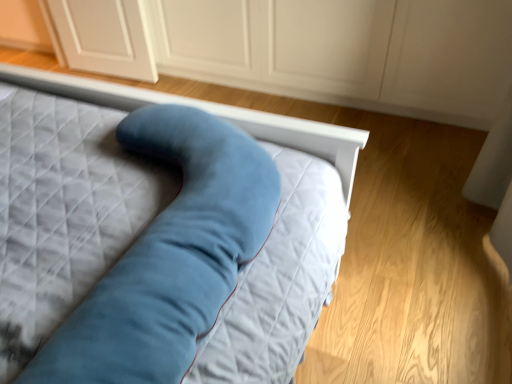
Describe the element at coordinates (347, 52) in the screenshot. I see `matte white dresser at center` at that location.

This screenshot has height=384, width=512. In order to click on matte white dresser at center in this screenshot , I will do tap(347, 52).

Locate an element on the screen. Image resolution: width=512 pixels, height=384 pixels. velvet blue pillow at center is located at coordinates (215, 114).

Measure the distance between point (313, 146) and camera.

Point (313, 146) is 1.28 meters from camera.

Describe the element at coordinates (215, 114) in the screenshot. I see `velvet blue pillow at center` at that location.

Identify the location of matte white dresser at center. The image size is (512, 384). (347, 52).

Between velvet blue pillow at center and matte white dresser at center, which one appears on the left side from the viewer's perspective?

velvet blue pillow at center is more to the left.

Is velvet blue pillow at center closer to the viewer compared to matte white dresser at center?

Yes, velvet blue pillow at center is closer to the viewer.

Does point (261, 135) lie in front of point (469, 12)?

Yes, it is in front of point (469, 12).

From the image's perspective, between velvet blue pillow at center and matte white dresser at center, who is located below?

velvet blue pillow at center.

From a real-world perspective, is velvet blue pillow at center over matte white dresser at center?

Yes.

Can you confirm if velvet blue pillow at center is wider than matte white dresser at center?

Yes.

In the scene shown: Considering the relative sizes of velvet blue pillow at center and matte white dresser at center in the image provided, is velvet blue pillow at center shorter than matte white dresser at center?

Yes, velvet blue pillow at center is shorter than matte white dresser at center.

Who is bigger, velvet blue pillow at center or matte white dresser at center?

With larger size is matte white dresser at center.

Could matte white dresser at center be considered to be inside velvet blue pillow at center?

Actually, matte white dresser at center is outside velvet blue pillow at center.

Is velvet blue pillow at center beside matte white dresser at center?

No, velvet blue pillow at center is not next to matte white dresser at center.

Looking at this image, is velvet blue pillow at center oriented towards matte white dresser at center?

Yes, velvet blue pillow at center faces towards matte white dresser at center.

How much distance is there between velvet blue pillow at center and matte white dresser at center?

velvet blue pillow at center and matte white dresser at center are 1.14 meters apart from each other.

This screenshot has width=512, height=384. I want to click on bed that appears on the left of matte white dresser at center, so click(x=215, y=114).

Would you say matte white dresser at center is to the left or to the right of velvet blue pillow at center in the picture?

From the image, it's evident that matte white dresser at center is to the right of velvet blue pillow at center.

Between matte white dresser at center and velvet blue pillow at center, which one is positioned behind?

matte white dresser at center is behind.

Considering the points (351, 70) and (270, 133), which point is in front, point (351, 70) or point (270, 133)?

Positioned in front is point (270, 133).

From the image's perspective, does matte white dresser at center appear higher than velvet blue pillow at center?

Correct, matte white dresser at center appears higher than velvet blue pillow at center in the image.

From a real-world perspective, is matte white dresser at center on top of velvet blue pillow at center?

Actually, matte white dresser at center is physically below velvet blue pillow at center in the real world.

Considering the sizes of objects matte white dresser at center and velvet blue pillow at center in the image provided, who is wider, matte white dresser at center or velvet blue pillow at center?

velvet blue pillow at center.

Can you confirm if matte white dresser at center is taller than velvet blue pillow at center?

Indeed, matte white dresser at center has a greater height compared to velvet blue pillow at center.

Consider the image. Which of these two, matte white dresser at center or velvet blue pillow at center, is smaller?

velvet blue pillow at center is smaller.

Choose the correct answer: Is matte white dresser at center inside velvet blue pillow at center or outside it?

matte white dresser at center is not enclosed by velvet blue pillow at center.

Would you say matte white dresser at center is a long distance from velvet blue pillow at center?

Absolutely, matte white dresser at center is distant from velvet blue pillow at center.

Does matte white dresser at center turn towards velvet blue pillow at center?

Yes.

Identify the location of dresser that appears behind the velvet blue pillow at center. Image resolution: width=512 pixels, height=384 pixels. (347, 52).

You are a GUI agent. You are given a task and a screenshot of the screen. Output one action in this format:
    pyautogui.click(x=<x>, y=<y>)
    Task: Click on the dresser below the velvet blue pillow at center (from a real-world perspective)
    The image size is (512, 384).
    Given the screenshot: What is the action you would take?
    pyautogui.click(x=347, y=52)

Where is `bed lying in front of the matte white dresser at center`? bed lying in front of the matte white dresser at center is located at coordinates [x=215, y=114].